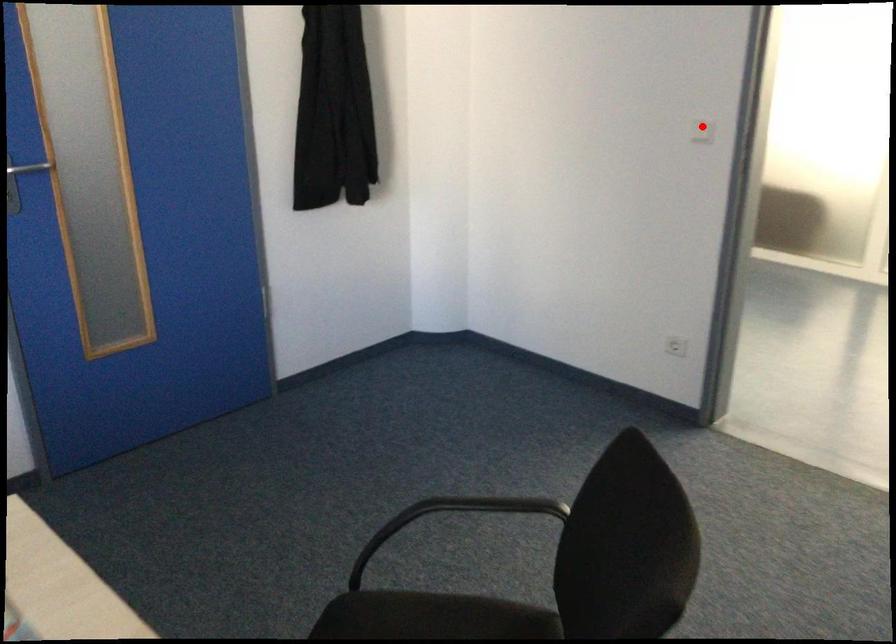
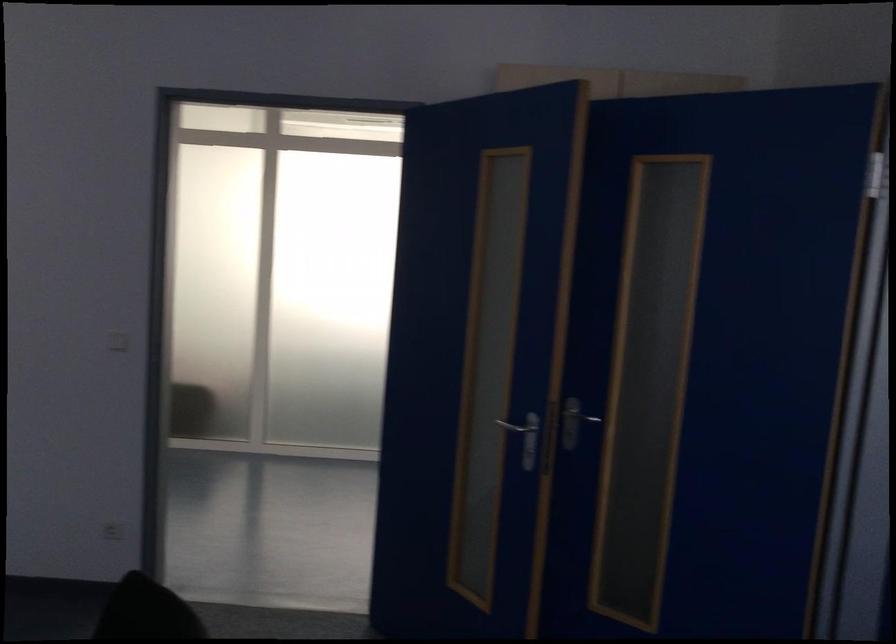
Find the pixel in the second image that matches the highlighted location in the first image.

(117, 341)